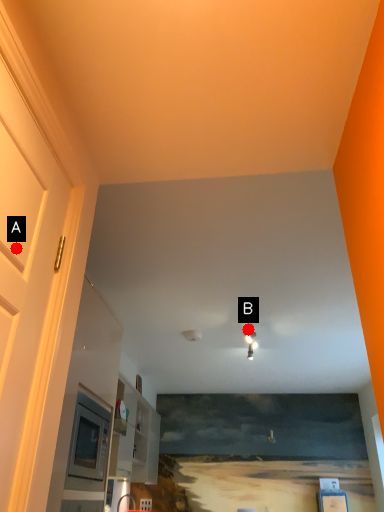
Question: Two points are circled on the image, labeled by A and B beside each circle. Among these points, which one is farthest from the camera?

Choices:
 (A) A is further
 (B) B is further

Answer: (B)